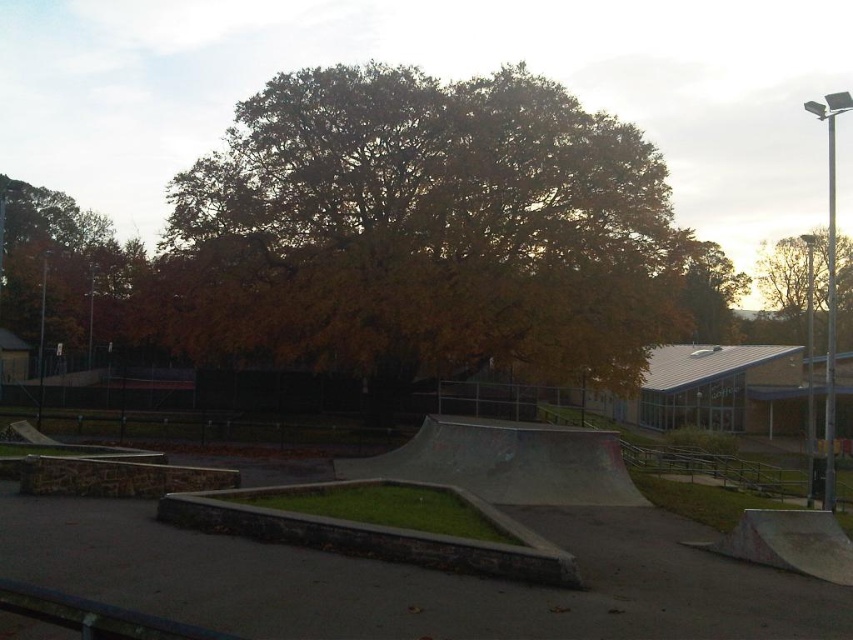
You are a skateboarder at the skatepark. You notice autumn leaves at left and a brown leafy tree at upper right. Which object is positioned higher in the image?

The autumn leaves at left are positioned higher in the image than the brown leafy tree at upper right.